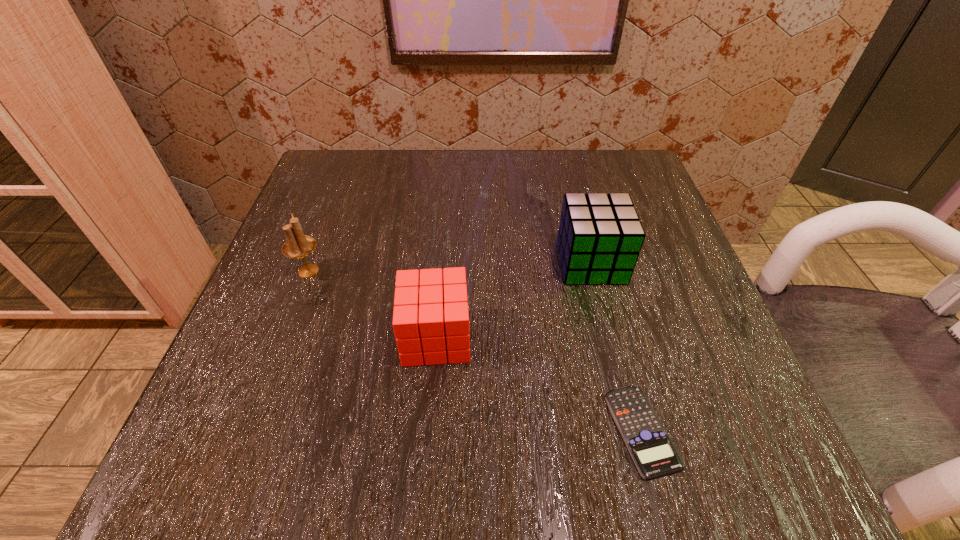
Find the location of a particular element. candle holder is located at coordinates (298, 245).

What are the coordinates of `the right cube` in the screenshot? It's located at (600, 236).

Find the location of `the third object from right to left`. the third object from right to left is located at coordinates (427, 315).

Identify the location of the left cube. (427, 315).

Locate an element on the screen. the shortest object is located at coordinates click(x=652, y=450).

Identify the location of calculator. The height and width of the screenshot is (540, 960). (652, 450).

In order to click on free space located on the front of the leftmost object in this screenshot , I will do `click(255, 412)`.

Identify the location of blank area located 0.250m on the left of the right cube. This screenshot has height=540, width=960. (421, 262).

Image resolution: width=960 pixels, height=540 pixels. I want to click on free region located on the back of the third farthest object, so click(x=449, y=181).

At what (x,y) coordinates should I click in order to perform the action: click on vacant space located on the back of the shortest object. Please return your answer as a coordinate pair (x, y). The image size is (960, 540). Looking at the image, I should click on (623, 357).